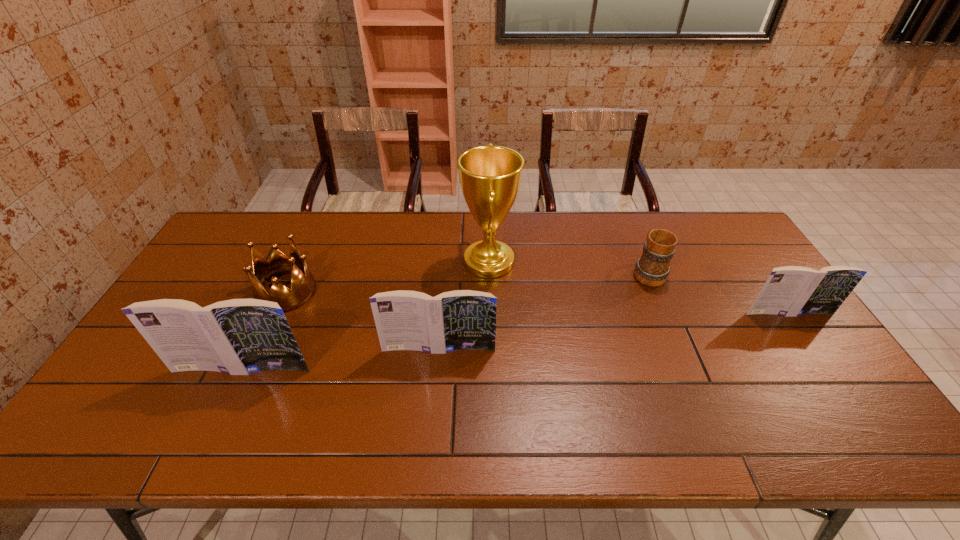
Image resolution: width=960 pixels, height=540 pixels. I want to click on book that is the second closest to the third tallest object, so click(789, 291).

Image resolution: width=960 pixels, height=540 pixels. I want to click on book that stands as the third closest to the crown, so 789,291.

Image resolution: width=960 pixels, height=540 pixels. Identify the location of vacant space that satisfies the following two spatial constraints: 1. by the handles of the tallest object; 2. on the front cover of the nearest object. (492, 369).

The height and width of the screenshot is (540, 960). Identify the location of free region that satisfies the following two spatial constraints: 1. by the handles of the tallest object; 2. on the front cover of the second farthest book. (491, 349).

Locate an element on the screen. vacant area that satisfies the following two spatial constraints: 1. by the handles of the award; 2. on the front cover of the leftmost book is located at coordinates (492, 369).

Where is `free space that satisfies the following two spatial constraints: 1. on the side of the mug with the handle; 2. by the handles of the tallest object`? free space that satisfies the following two spatial constraints: 1. on the side of the mug with the handle; 2. by the handles of the tallest object is located at coordinates (644, 262).

Where is `vacant space that satisfies the following two spatial constraints: 1. by the handles of the tallest object; 2. on the front cover of the fifth farthest object`? The width and height of the screenshot is (960, 540). vacant space that satisfies the following two spatial constraints: 1. by the handles of the tallest object; 2. on the front cover of the fifth farthest object is located at coordinates (491, 349).